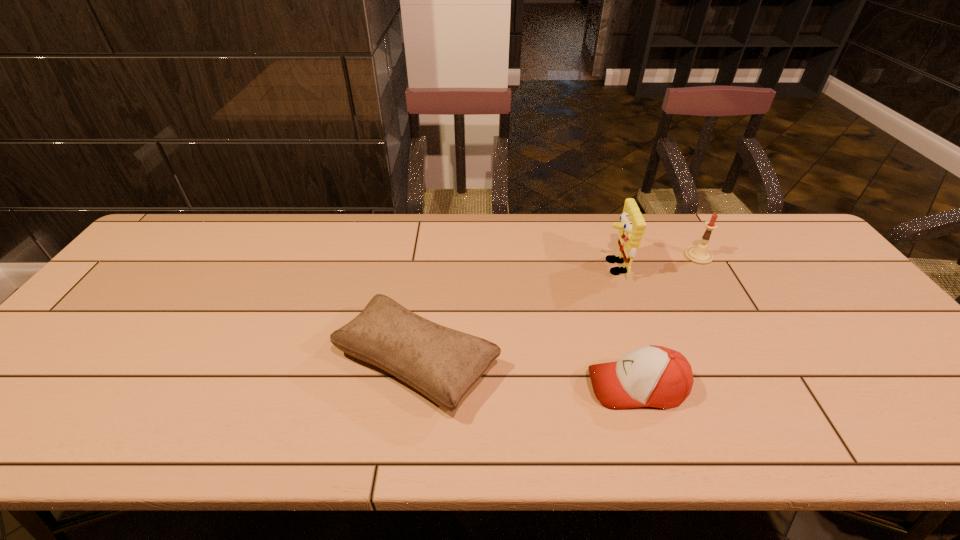
Locate which object is the third closest to the baseball cap. Please provide its 2D coordinates. Your answer should be formatted as a tuple, i.e. [(x, y)], where the tuple contains the x and y coordinates of a point satisfying the conditions above.

[(699, 254)]

I want to click on the third closest object to the leftmost object, so click(x=699, y=254).

Image resolution: width=960 pixels, height=540 pixels. I want to click on free point that satisfies the following two spatial constraints: 1. on the face of the tallest object; 2. on the front side of the cushion, so click(x=647, y=363).

Where is `vacant space that satisfies the following two spatial constraints: 1. on the front side of the rightmost object; 2. on the front-facing side of the baseball cap`? The width and height of the screenshot is (960, 540). vacant space that satisfies the following two spatial constraints: 1. on the front side of the rightmost object; 2. on the front-facing side of the baseball cap is located at coordinates (774, 387).

Find the location of `vacant space that satisfies the following two spatial constraints: 1. on the face of the tallest object; 2. on the front side of the cushion`. vacant space that satisfies the following two spatial constraints: 1. on the face of the tallest object; 2. on the front side of the cushion is located at coordinates (647, 363).